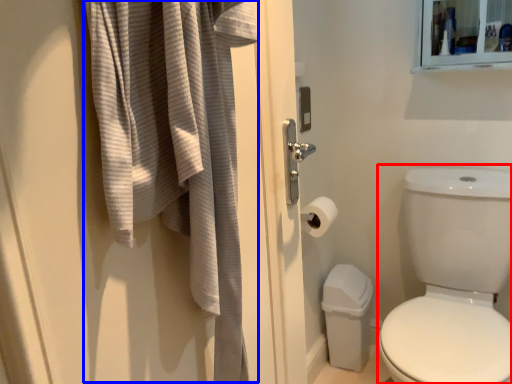
Question: Which object appears closest to the camera in this image, toilet bowl (highlighted by a red box) or bath towel (highlighted by a blue box)?

Choices:
 (A) toilet bowl
 (B) bath towel

Answer: (B)